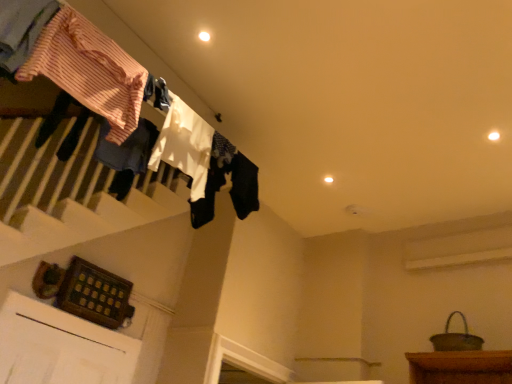
The width and height of the screenshot is (512, 384). What do you see at coordinates (22, 29) in the screenshot?
I see `striped cotton shirt at upper left, positioned as the 1th clothing in front-to-back order` at bounding box center [22, 29].

Consider the image. What is the approximate height of striped cotton shirt at upper left, arranged as the 2th clothing when viewed from the front?

It is 20.65 inches.

Locate an element on the screen. striped cotton shirt at upper left, marked as the 4th clothing in a back-to-front arrangement is located at coordinates (22, 29).

Locate an element on the screen. The width and height of the screenshot is (512, 384). the 1st clothing above when counting from the white cotton socks at upper center, arranged as the fourth clothing when viewed from the front (from the image's perspective) is located at coordinates (184, 145).

Could you measure the distance between white fabric at upper center, the 3th clothing in the front-to-back sequence, and white cotton socks at upper center, which is the 1th clothing in back-to-front order?

white fabric at upper center, the 3th clothing in the front-to-back sequence, is 9.65 inches from white cotton socks at upper center, which is the 1th clothing in back-to-front order.

Which point is more distant from viewer, [196,152] or [212,211]?

Positioned behind is point [212,211].

Considering the positions of objects white fabric at upper center, which is the 2th clothing from back to front, and white cotton socks at upper center, arranged as the fourth clothing when viewed from the front, in the image provided, who is more to the left, white fabric at upper center, which is the 2th clothing from back to front, or white cotton socks at upper center, arranged as the fourth clothing when viewed from the front,?

Positioned to the left is white fabric at upper center, which is the 2th clothing from back to front.

Is white cotton socks at upper center, which is the 1th clothing in back-to-front order, thinner than striped cotton shirt at upper left, the third clothing in the back-to-front sequence?

Indeed, white cotton socks at upper center, which is the 1th clothing in back-to-front order, has a lesser width compared to striped cotton shirt at upper left, the third clothing in the back-to-front sequence.

Can you confirm if white cotton socks at upper center, arranged as the fourth clothing when viewed from the front, is bigger than striped cotton shirt at upper left, arranged as the 2th clothing when viewed from the front?

Actually, white cotton socks at upper center, arranged as the fourth clothing when viewed from the front, might be smaller than striped cotton shirt at upper left, arranged as the 2th clothing when viewed from the front.

Between white cotton socks at upper center, which is the 1th clothing in back-to-front order, and striped cotton shirt at upper left, arranged as the 2th clothing when viewed from the front, which one appears on the right side from the viewer's perspective?

Positioned to the right is white cotton socks at upper center, which is the 1th clothing in back-to-front order.

Between striped cotton shirt at upper left, the third clothing in the back-to-front sequence, and white fabric at upper center, the 3th clothing in the front-to-back sequence, which one has less height?

With less height is striped cotton shirt at upper left, the third clothing in the back-to-front sequence.

What's the angular difference between striped cotton shirt at upper left, the third clothing in the back-to-front sequence, and white fabric at upper center, the 3th clothing in the front-to-back sequence,'s facing directions?

0.000801 degrees.

From a real-world perspective, is striped cotton shirt at upper left, arranged as the 2th clothing when viewed from the front, under white fabric at upper center, the 3th clothing in the front-to-back sequence?

Yes, from a real-world perspective, striped cotton shirt at upper left, arranged as the 2th clothing when viewed from the front, is below white fabric at upper center, the 3th clothing in the front-to-back sequence.

Considering the relative sizes of striped cotton shirt at upper left, the third clothing in the back-to-front sequence, and white fabric at upper center, which is the 2th clothing from back to front, in the image provided, is striped cotton shirt at upper left, the third clothing in the back-to-front sequence, wider than white fabric at upper center, which is the 2th clothing from back to front,?

Indeed, striped cotton shirt at upper left, the third clothing in the back-to-front sequence, has a greater width compared to white fabric at upper center, which is the 2th clothing from back to front.

Which is nearer, [12,14] or [92,83]?

Point [12,14] is positioned closer to the camera compared to point [92,83].

Can you confirm if striped cotton shirt at upper left, positioned as the 1th clothing in front-to-back order, is wider than striped cotton shirt at upper left, the third clothing in the back-to-front sequence?

No.

Considering the relative positions of striped cotton shirt at upper left, marked as the 4th clothing in a back-to-front arrangement, and striped cotton shirt at upper left, the third clothing in the back-to-front sequence, in the image provided, is striped cotton shirt at upper left, marked as the 4th clothing in a back-to-front arrangement, to the left or to the right of striped cotton shirt at upper left, the third clothing in the back-to-front sequence,?

striped cotton shirt at upper left, marked as the 4th clothing in a back-to-front arrangement, is positioned on striped cotton shirt at upper left, the third clothing in the back-to-front sequence,'s left side.

How far apart are striped cotton shirt at upper left, positioned as the 1th clothing in front-to-back order, and striped cotton shirt at upper left, the third clothing in the back-to-front sequence?

striped cotton shirt at upper left, positioned as the 1th clothing in front-to-back order, and striped cotton shirt at upper left, the third clothing in the back-to-front sequence, are 8.59 inches apart.

Is white fabric at upper center, the 3th clothing in the front-to-back sequence, outside of striped cotton shirt at upper left, the third clothing in the back-to-front sequence?

That's correct, white fabric at upper center, the 3th clothing in the front-to-back sequence, is outside of striped cotton shirt at upper left, the third clothing in the back-to-front sequence.

Considering the relative positions of white fabric at upper center, which is the 2th clothing from back to front, and striped cotton shirt at upper left, arranged as the 2th clothing when viewed from the front, in the image provided, is white fabric at upper center, which is the 2th clothing from back to front, to the left or to the right of striped cotton shirt at upper left, arranged as the 2th clothing when viewed from the front,?

Based on their positions, white fabric at upper center, which is the 2th clothing from back to front, is located to the right of striped cotton shirt at upper left, arranged as the 2th clothing when viewed from the front.

Is white fabric at upper center, which is the 2th clothing from back to front, oriented away from striped cotton shirt at upper left, the third clothing in the back-to-front sequence?

That's not correct — white fabric at upper center, which is the 2th clothing from back to front, is not looking away from striped cotton shirt at upper left, the third clothing in the back-to-front sequence.

From the striped cotton shirt at upper left, the third clothing in the back-to-front sequence, count 1st clothings backward and point to it. Please provide its 2D coordinates.

[(184, 145)]

Is point (22, 45) less distant than point (184, 107)?

Yes, point (22, 45) is closer to viewer.

Is striped cotton shirt at upper left, positioned as the 1th clothing in front-to-back order, located outside white fabric at upper center, the 3th clothing in the front-to-back sequence?

That's correct, striped cotton shirt at upper left, positioned as the 1th clothing in front-to-back order, is outside of white fabric at upper center, the 3th clothing in the front-to-back sequence.

Is striped cotton shirt at upper left, positioned as the 1th clothing in front-to-back order, looking in the opposite direction of white fabric at upper center, which is the 2th clothing from back to front?

No, striped cotton shirt at upper left, positioned as the 1th clothing in front-to-back order,'s orientation is not away from white fabric at upper center, which is the 2th clothing from back to front.

Considering the positions of objects striped cotton shirt at upper left, positioned as the 1th clothing in front-to-back order, and white fabric at upper center, which is the 2th clothing from back to front, in the image provided, who is more to the right, striped cotton shirt at upper left, positioned as the 1th clothing in front-to-back order, or white fabric at upper center, which is the 2th clothing from back to front,?

white fabric at upper center, which is the 2th clothing from back to front, is more to the right.

Does white cotton socks at upper center, which is the 1th clothing in back-to-front order, turn towards striped cotton shirt at upper left, positioned as the 1th clothing in front-to-back order?

No, white cotton socks at upper center, which is the 1th clothing in back-to-front order, is not oriented towards striped cotton shirt at upper left, positioned as the 1th clothing in front-to-back order.

Is white cotton socks at upper center, which is the 1th clothing in back-to-front order, beside striped cotton shirt at upper left, positioned as the 1th clothing in front-to-back order?

white cotton socks at upper center, which is the 1th clothing in back-to-front order, and striped cotton shirt at upper left, positioned as the 1th clothing in front-to-back order, are clearly separated.

Between white cotton socks at upper center, which is the 1th clothing in back-to-front order, and striped cotton shirt at upper left, positioned as the 1th clothing in front-to-back order, which one has larger size?

striped cotton shirt at upper left, positioned as the 1th clothing in front-to-back order.

From a real-world perspective, count 1st clothings downward from the white cotton socks at upper center, which is the 1th clothing in back-to-front order, and point to it. Please provide its 2D coordinates.

[(184, 145)]

Where is `clothing that is the 2nd one when counting rightward from the striped cotton shirt at upper left, the third clothing in the back-to-front sequence`? This screenshot has height=384, width=512. clothing that is the 2nd one when counting rightward from the striped cotton shirt at upper left, the third clothing in the back-to-front sequence is located at coordinates (208, 195).

Considering their positions, is striped cotton shirt at upper left, positioned as the 1th clothing in front-to-back order, positioned further to white cotton socks at upper center, which is the 1th clothing in back-to-front order, than white fabric at upper center, the 3th clothing in the front-to-back sequence?

Based on the image, striped cotton shirt at upper left, positioned as the 1th clothing in front-to-back order, appears to be further to white cotton socks at upper center, which is the 1th clothing in back-to-front order.

When comparing their distances from white cotton socks at upper center, which is the 1th clothing in back-to-front order, does striped cotton shirt at upper left, the third clothing in the back-to-front sequence, or white fabric at upper center, the 3th clothing in the front-to-back sequence, seem further?

striped cotton shirt at upper left, the third clothing in the back-to-front sequence, lies further to white cotton socks at upper center, which is the 1th clothing in back-to-front order, than the other object.

Looking at the image, which one is located closer to white cotton socks at upper center, which is the 1th clothing in back-to-front order, white fabric at upper center, which is the 2th clothing from back to front, or striped cotton shirt at upper left, arranged as the 2th clothing when viewed from the front?

white fabric at upper center, which is the 2th clothing from back to front.

Which object lies nearer to the anchor point striped cotton shirt at upper left, marked as the 4th clothing in a back-to-front arrangement, white cotton socks at upper center, arranged as the fourth clothing when viewed from the front, or striped cotton shirt at upper left, the third clothing in the back-to-front sequence?

striped cotton shirt at upper left, the third clothing in the back-to-front sequence, lies closer to striped cotton shirt at upper left, marked as the 4th clothing in a back-to-front arrangement, than the other object.

From the image, which object appears to be farther from white fabric at upper center, which is the 2th clothing from back to front, white cotton socks at upper center, arranged as the fourth clothing when viewed from the front, or striped cotton shirt at upper left, arranged as the 2th clothing when viewed from the front?

striped cotton shirt at upper left, arranged as the 2th clothing when viewed from the front, is further to white fabric at upper center, which is the 2th clothing from back to front.

Based on the photo, looking at the image, which one is located closer to striped cotton shirt at upper left, marked as the 4th clothing in a back-to-front arrangement, white fabric at upper center, which is the 2th clothing from back to front, or striped cotton shirt at upper left, the third clothing in the back-to-front sequence?

striped cotton shirt at upper left, the third clothing in the back-to-front sequence, is closer to striped cotton shirt at upper left, marked as the 4th clothing in a back-to-front arrangement.

When comparing their distances from striped cotton shirt at upper left, marked as the 4th clothing in a back-to-front arrangement, does white cotton socks at upper center, arranged as the fourth clothing when viewed from the front, or white fabric at upper center, which is the 2th clothing from back to front, seem closer?

white fabric at upper center, which is the 2th clothing from back to front, lies closer to striped cotton shirt at upper left, marked as the 4th clothing in a back-to-front arrangement, than the other object.

Which object lies further to the anchor point white fabric at upper center, which is the 2th clothing from back to front, striped cotton shirt at upper left, positioned as the 1th clothing in front-to-back order, or white cotton socks at upper center, arranged as the fourth clothing when viewed from the front?

striped cotton shirt at upper left, positioned as the 1th clothing in front-to-back order, is positioned further to the anchor white fabric at upper center, which is the 2th clothing from back to front.

The height and width of the screenshot is (384, 512). I want to click on clothing between striped cotton shirt at upper left, arranged as the 2th clothing when viewed from the front, and white cotton socks at upper center, which is the 1th clothing in back-to-front order, from front to back, so click(x=184, y=145).

This screenshot has width=512, height=384. What are the coordinates of `clothing between striped cotton shirt at upper left, marked as the 4th clothing in a back-to-front arrangement, and white fabric at upper center, which is the 2th clothing from back to front, from front to back` in the screenshot? It's located at (89, 70).